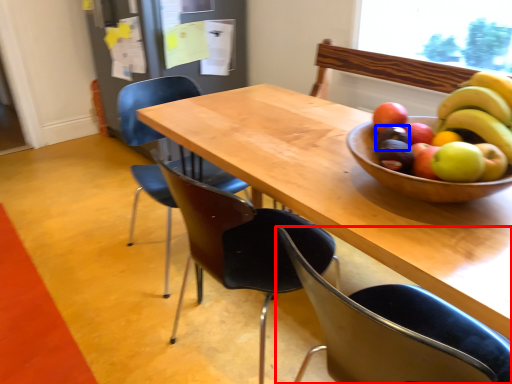
Question: Which of the following is the closest to the observer, chair (highlighted by a red box) or avocado (highlighted by a blue box)?

Choices:
 (A) chair
 (B) avocado

Answer: (A)